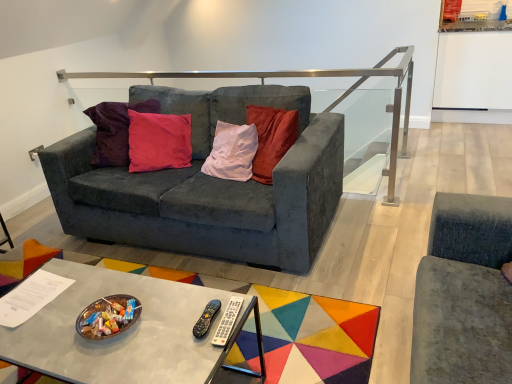
Question: Does silver plastic remote at center, arranged as the 1th remote when viewed from the right, have a lesser height compared to velvet dark gray couch at center?

Choices:
 (A) no
 (B) yes

Answer: (B)

Question: Is silver plastic remote at center, the 2th remote when ordered from left to right, positioned far away from velvet dark gray couch at center?

Choices:
 (A) no
 (B) yes

Answer: (B)

Question: Can you confirm if silver plastic remote at center, arranged as the 1th remote when viewed from the right, is positioned to the right of velvet dark gray couch at center?

Choices:
 (A) no
 (B) yes

Answer: (B)

Question: Does silver plastic remote at center, the 2th remote when ordered from left to right, have a greater width compared to velvet dark gray couch at center?

Choices:
 (A) no
 (B) yes

Answer: (A)

Question: From a real-world perspective, is silver plastic remote at center, the 2th remote when ordered from left to right, located beneath velvet dark gray couch at center?

Choices:
 (A) no
 (B) yes

Answer: (A)

Question: From a real-world perspective, is velvet dark gray couch at center physically located above or below satin silver rail at upper center?

Choices:
 (A) below
 (B) above

Answer: (A)

Question: Does point (253, 92) appear closer or farther from the camera than point (391, 51)?

Choices:
 (A) farther
 (B) closer

Answer: (B)

Question: Considering the relative positions of velvet dark gray couch at center and satin silver rail at upper center in the image provided, is velvet dark gray couch at center to the left or to the right of satin silver rail at upper center?

Choices:
 (A) left
 (B) right

Answer: (A)

Question: From the image's perspective, is velvet dark gray couch at center located above or below satin silver rail at upper center?

Choices:
 (A) above
 (B) below

Answer: (B)

Question: Would you say silver plastic remote at center, arranged as the 1th remote when viewed from the right, is to the left or to the right of metallic gray coffee table at center in the picture?

Choices:
 (A) left
 (B) right

Answer: (B)

Question: In the image, is silver plastic remote at center, arranged as the 1th remote when viewed from the right, positioned in front of or behind metallic gray coffee table at center?

Choices:
 (A) front
 (B) behind

Answer: (B)

Question: Considering the positions of silver plastic remote at center, the 2th remote when ordered from left to right, and metallic gray coffee table at center in the image, is silver plastic remote at center, the 2th remote when ordered from left to right, bigger or smaller than metallic gray coffee table at center?

Choices:
 (A) small
 (B) big

Answer: (A)

Question: Is point (222, 339) closer or farther from the camera than point (153, 342)?

Choices:
 (A) closer
 (B) farther

Answer: (A)

Question: Considering the positions of point (200, 329) and point (214, 291), is point (200, 329) closer or farther from the camera than point (214, 291)?

Choices:
 (A) farther
 (B) closer

Answer: (B)

Question: From a real-world perspective, is black plastic remote at center, which is the 1th remote from left to right, positioned above or below metallic gray coffee table at center?

Choices:
 (A) above
 (B) below

Answer: (A)